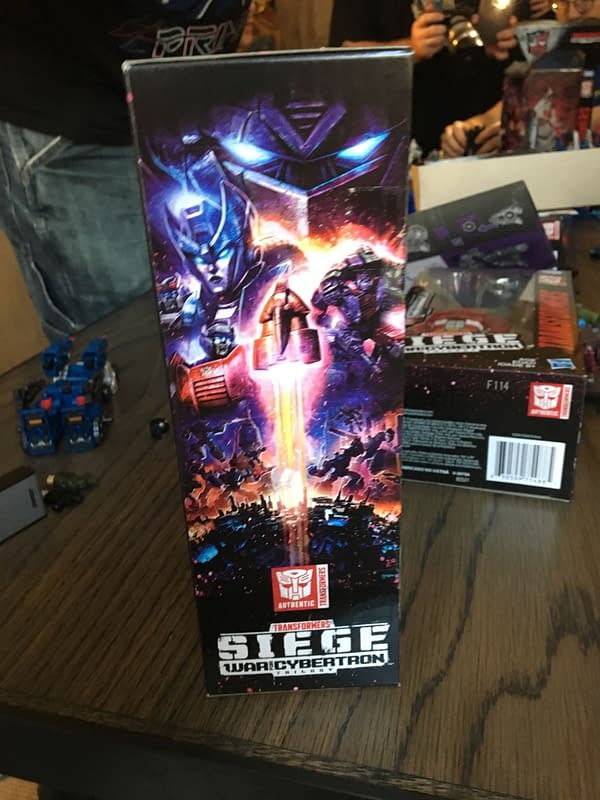
Identify the location of wooden table. (543, 650).